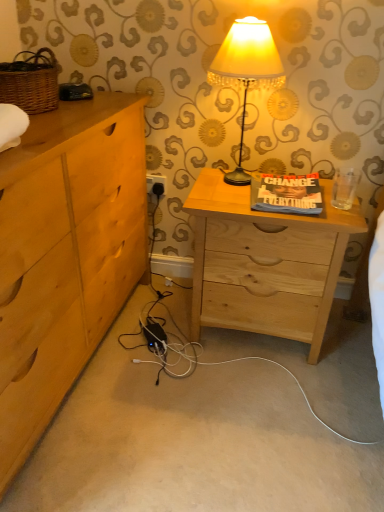
Image resolution: width=384 pixels, height=512 pixels. I want to click on free space in front of matte cream lampshade at center, so click(237, 198).